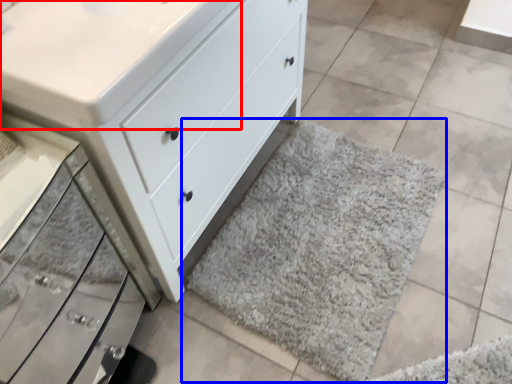
Question: Which of the following is the closest to the observer, counter top (highlighted by a red box) or bath mat (highlighted by a blue box)?

Choices:
 (A) counter top
 (B) bath mat

Answer: (A)